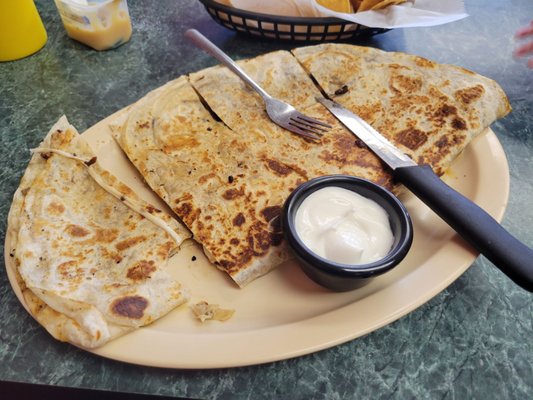
This screenshot has width=533, height=400. What are the coordinates of `fork` in the screenshot? It's located at (259, 89).